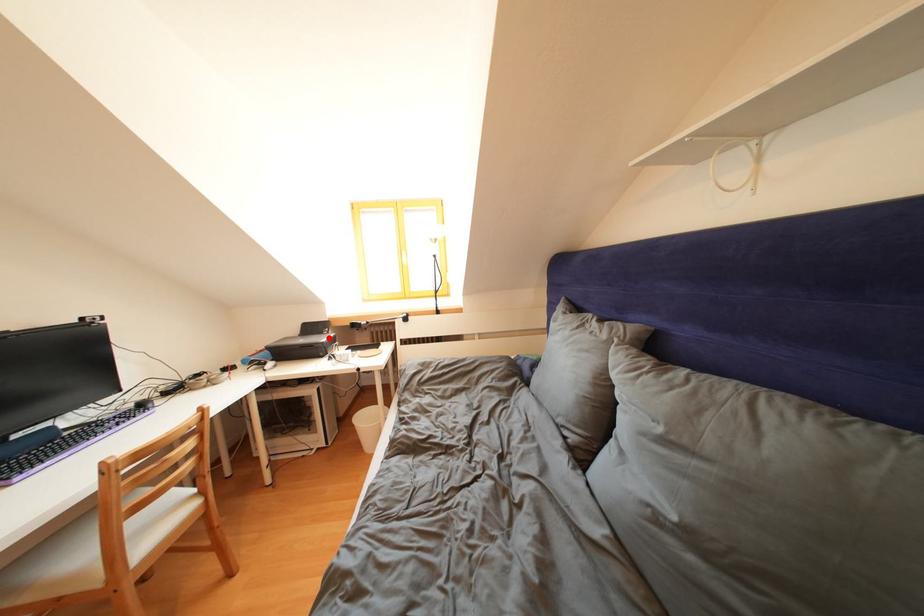
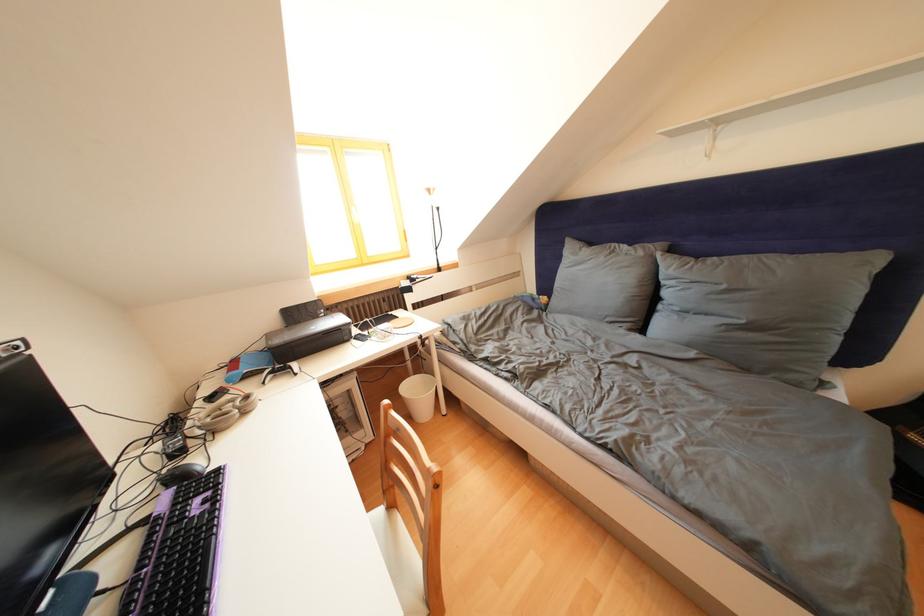
Question: I am providing you with two images of the same scene from different viewpoints. Given a red point in image1, look at the same physical point in image2. Is it:

Choices:
 (A) Closer to the viewpoint
 (B) Farther from the viewpoint

Answer: (A)